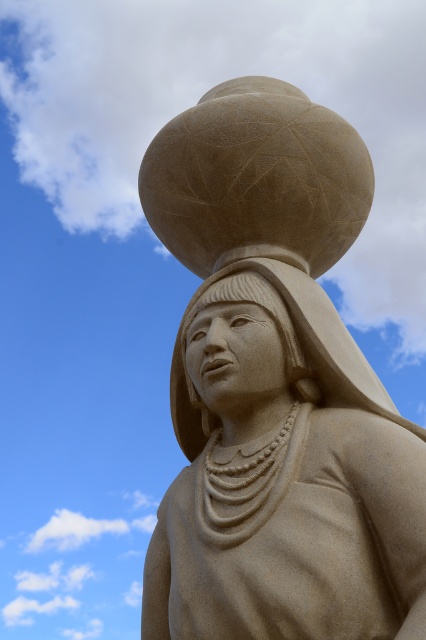
You are an architect designing a new museum exhibit and need to place a spotlight on the beige stone sphere at upper center. The coordinates given are point [276,388]. Where should you position the spotlight to ensure it illuminates the beige stone sphere at upper center effectively?

The point [276,388] marks the beige stone sphere at upper center, so position the spotlight directly above or facing this coordinate to illuminate it effectively.

You are an art conservator examining the stone sculpture from a distance. You notice two points on the sculpture marked as point 1 at coordinates point (319,624) and point 2 at coordinates point (236,435). Which point is closer to you?

Point (319,624) is in front of point (236,435), so it is closer to you.

Based on the photo, you are an art conservator assessing the stone sculpture. You notice the beige stone sphere at upper center and the sandy beige statue at center. Which object has a greater width according to the description?

The beige stone sphere at upper center has a greater width than the sandy beige statue at center.